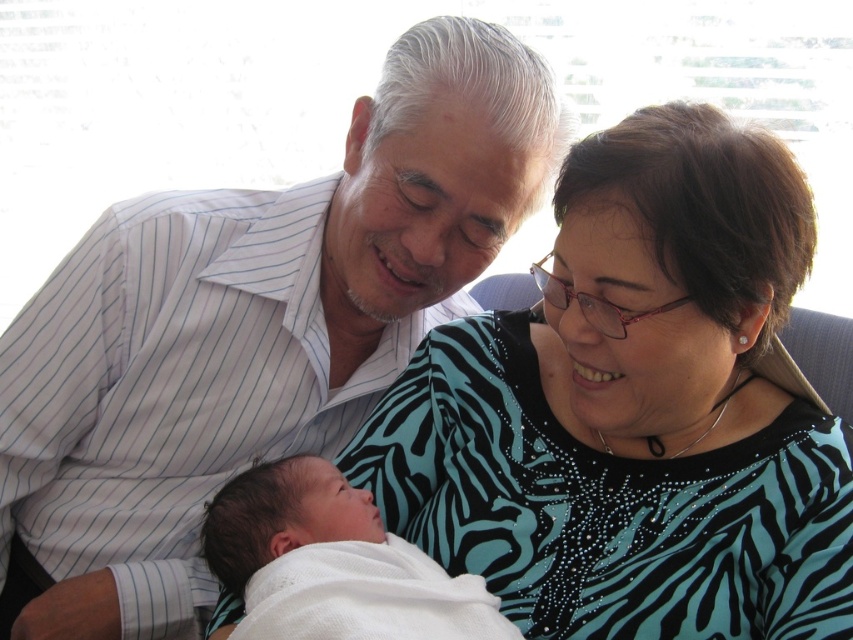
From the picture: Can you confirm if zebra print blouse at center is shorter than white soft cloth at center?

In fact, zebra print blouse at center may be taller than white soft cloth at center.

Does zebra print blouse at center lie in front of white soft cloth at center?

No.

Find the location of a particular element. Image resolution: width=853 pixels, height=640 pixels. zebra print blouse at center is located at coordinates (635, 408).

This screenshot has width=853, height=640. What do you see at coordinates (248, 332) in the screenshot?
I see `white striped shirt at upper left` at bounding box center [248, 332].

Which is more to the left, white striped shirt at upper left or white soft cloth at center?

From the viewer's perspective, white striped shirt at upper left appears more on the left side.

Is point (505, 186) positioned behind point (354, 588)?

Yes, it is behind point (354, 588).

Find the location of a particular element. The width and height of the screenshot is (853, 640). white striped shirt at upper left is located at coordinates click(x=248, y=332).

Is point (709, 470) positioned in front of point (107, 356)?

Yes, point (709, 470) is closer to viewer.

Who is higher up, zebra print blouse at center or white striped shirt at upper left?

white striped shirt at upper left is above.

Which is behind, point (791, 218) or point (163, 428)?

Point (163, 428)

The width and height of the screenshot is (853, 640). Find the location of `zebra print blouse at center`. zebra print blouse at center is located at coordinates (635, 408).